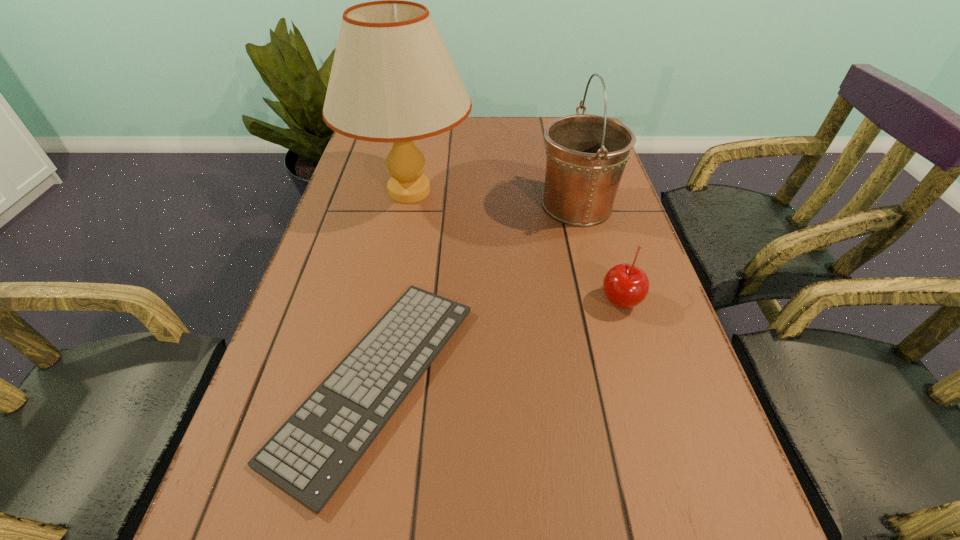
Locate an element on the screen. The width and height of the screenshot is (960, 540). free point between the cherry and the computer keyboard is located at coordinates (497, 340).

Identify the location of free space between the tallest object and the bucket. The width and height of the screenshot is (960, 540). (492, 199).

This screenshot has height=540, width=960. Find the location of `free space between the cherry and the tallest object`. free space between the cherry and the tallest object is located at coordinates (515, 246).

The image size is (960, 540). What are the coordinates of `blank region between the computer keyboard and the lampshade` in the screenshot? It's located at (393, 286).

In order to click on empty space between the computer keyboard and the cherry in this screenshot , I will do `click(497, 340)`.

Choose which object is the nearest neighbor to the lampshade. Please provide its 2D coordinates. Your answer should be formatted as a tuple, i.e. [(x, y)], where the tuple contains the x and y coordinates of a point satisfying the conditions above.

[(586, 154)]

Select which object is the closest to the computer keyboard. Please provide its 2D coordinates. Your answer should be formatted as a tuple, i.e. [(x, y)], where the tuple contains the x and y coordinates of a point satisfying the conditions above.

[(392, 80)]

The width and height of the screenshot is (960, 540). Identify the location of free space that satisfies the following two spatial constraints: 1. on the front side of the tallest object; 2. on the left side of the third tallest object. (388, 300).

This screenshot has height=540, width=960. What are the coordinates of `free space that satisfies the following two spatial constraints: 1. on the front side of the lampshade; 2. on the right side of the cherry` in the screenshot? It's located at (388, 300).

Where is `free region that satisfies the following two spatial constraints: 1. on the front side of the lampshade; 2. on the right side of the shortest object`? free region that satisfies the following two spatial constraints: 1. on the front side of the lampshade; 2. on the right side of the shortest object is located at coordinates (372, 380).